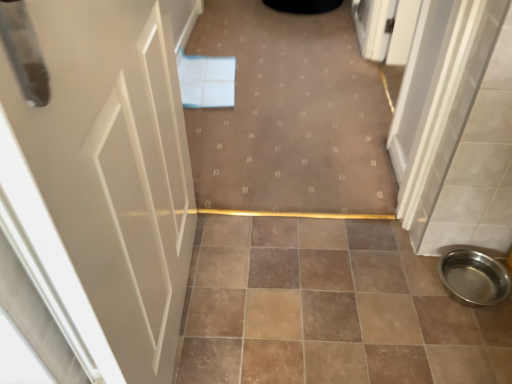
Question: Is white glossy door at left positioned with its back to brown ceramic tile at center?

Choices:
 (A) no
 (B) yes

Answer: (A)

Question: Considering the relative positions of white glossy door at left and brown ceramic tile at center in the image provided, is white glossy door at left to the right of brown ceramic tile at center from the viewer's perspective?

Choices:
 (A) no
 (B) yes

Answer: (A)

Question: Is white glossy door at left far from brown ceramic tile at center?

Choices:
 (A) yes
 (B) no

Answer: (B)

Question: From the image's perspective, is white glossy door at left beneath brown ceramic tile at center?

Choices:
 (A) no
 (B) yes

Answer: (A)

Question: From the image's perspective, is white glossy door at left above brown ceramic tile at center?

Choices:
 (A) no
 (B) yes

Answer: (B)

Question: From a real-world perspective, relative to carpet at center, is brown ceramic tile at center vertically above or below?

Choices:
 (A) below
 (B) above

Answer: (B)

Question: In the image, is brown ceramic tile at center positioned in front of or behind carpet at center?

Choices:
 (A) behind
 (B) front

Answer: (B)

Question: Considering the positions of brown ceramic tile at center and carpet at center in the image, is brown ceramic tile at center taller or shorter than carpet at center?

Choices:
 (A) tall
 (B) short

Answer: (B)

Question: Is brown ceramic tile at center inside or outside of carpet at center?

Choices:
 (A) inside
 (B) outside

Answer: (B)

Question: Considering the positions of point [x=444, y=264] and point [x=266, y=183], is point [x=444, y=264] closer or farther from the camera than point [x=266, y=183]?

Choices:
 (A) closer
 (B) farther

Answer: (A)

Question: Is polished stainless steel bowl at lower right taller or shorter than carpet at center?

Choices:
 (A) tall
 (B) short

Answer: (A)

Question: Looking at their shapes, would you say polished stainless steel bowl at lower right is wider or thinner than carpet at center?

Choices:
 (A) thin
 (B) wide

Answer: (A)

Question: Looking at the image, does polished stainless steel bowl at lower right seem bigger or smaller compared to carpet at center?

Choices:
 (A) small
 (B) big

Answer: (A)

Question: Looking at the image, does white glossy door at left seem bigger or smaller compared to brown ceramic tile at center?

Choices:
 (A) small
 (B) big

Answer: (B)

Question: Does point (16, 142) appear closer or farther from the camera than point (230, 297)?

Choices:
 (A) farther
 (B) closer

Answer: (B)